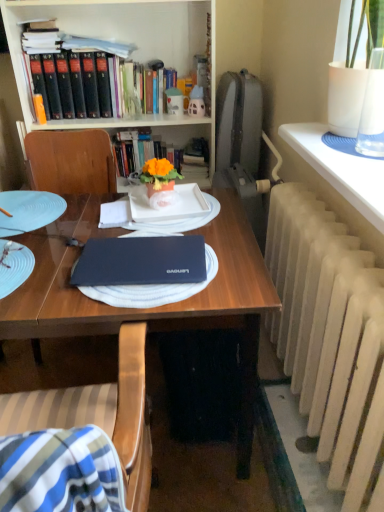
What is the approximate width of matte black bookcase at upper left?

It is 16.62 inches.

The image size is (384, 512). What are the coordinates of `white matte plate at center` in the screenshot? It's located at (154, 221).

Describe the element at coordinates (141, 261) in the screenshot. The width and height of the screenshot is (384, 512). I see `matte black laptop at center` at that location.

What is the approximate width of orange matte flower pot at center?

It is 6.07 inches.

This screenshot has height=512, width=384. Find the location of `white painted radiator at right`. white painted radiator at right is located at coordinates (326, 324).

Considering the relative sizes of orange matte flower pot at center and blue matte glass plate at left in the image provided, is orange matte flower pot at center smaller than blue matte glass plate at left?

No, orange matte flower pot at center is not smaller than blue matte glass plate at left.

What's the angular difference between orange matte flower pot at center and blue matte glass plate at left's facing directions?

6.93 degrees separate the facing orientations of orange matte flower pot at center and blue matte glass plate at left.

Considering the positions of objects orange matte flower pot at center and blue matte glass plate at left in the image provided, who is more to the left, orange matte flower pot at center or blue matte glass plate at left?

From the viewer's perspective, blue matte glass plate at left appears more on the left side.

From a real-world perspective, does orange matte flower pot at center sit lower than blue matte glass plate at left?

No, from a real-world perspective, orange matte flower pot at center is not below blue matte glass plate at left.

Can you tell me how much matte black laptop at center and orange matte flower pot at center differ in facing direction?

The angular difference between matte black laptop at center and orange matte flower pot at center is 84.2 degrees.

From a real-world perspective, which object stands above the other?

orange matte flower pot at center.

Considering the relative sizes of matte black laptop at center and orange matte flower pot at center in the image provided, is matte black laptop at center taller than orange matte flower pot at center?

Indeed, matte black laptop at center has a greater height compared to orange matte flower pot at center.

Which point is more distant from viewer, (233, 283) or (174, 169)?

Positioned behind is point (174, 169).

From the image's perspective, which object appears higher, wooden chair at center or white painted radiator at right?

white painted radiator at right, from the image's perspective.

Is point (29, 424) behind point (354, 346)?

That is False.

Is wooden chair at center facing away from white painted radiator at right?

No, white painted radiator at right is not at the back of wooden chair at center.

Looking at this image, is wooden chair at center smaller than white painted radiator at right?

Actually, wooden chair at center might be larger than white painted radiator at right.

Which object is positioned more to the left, white textured radiator at right, the 1th table when ordered from right to left, or orange matte flower pot at center?

From the viewer's perspective, orange matte flower pot at center appears more on the left side.

Which object is further away from the camera, white textured radiator at right, which ranks as the second table in back-to-front order, or orange matte flower pot at center?

orange matte flower pot at center is further from the camera.

Who is taller, white textured radiator at right, the 1th table positioned from the front, or orange matte flower pot at center?

orange matte flower pot at center is taller.

Is white textured radiator at right, the 1th table positioned from the front, thinner than orange matte flower pot at center?

No.

Is matte black laptop at center far from white textured radiator at right, the 1th table when ordered from right to left?

No, matte black laptop at center is in close proximity to white textured radiator at right, the 1th table when ordered from right to left.

Is matte black laptop at center facing away from white textured radiator at right, which is counted as the 2th table, starting from the left?

No, matte black laptop at center is not facing the opposite direction of white textured radiator at right, which is counted as the 2th table, starting from the left.

Image resolution: width=384 pixels, height=512 pixels. I want to click on laptop on the left of the white textured radiator at right, which is counted as the 2th table, starting from the left, so click(x=141, y=261).

From the image's perspective, is matte black laptop at center beneath white textured radiator at right, the 1th table positioned from the front?

Yes, from the image's perspective, matte black laptop at center is beneath white textured radiator at right, the 1th table positioned from the front.

From a real-world perspective, between white painted radiator at right and matte black laptop at center, who is vertically higher?

In real-world perspective, white painted radiator at right is above.

In the scene shown: Is white painted radiator at right far away from matte black laptop at center?

Actually, white painted radiator at right and matte black laptop at center are a little close together.

From the picture: Is white painted radiator at right spatially inside matte black laptop at center, or outside of it?

white painted radiator at right exists outside the volume of matte black laptop at center.

What's the angular difference between white painted radiator at right and matte black laptop at center's facing directions?

white painted radiator at right and matte black laptop at center are facing 88.1 degrees away from each other.

In terms of width, does white textured radiator at right, the 1th table positioned from the front, look wider or thinner when compared to matte black laptop at center?

In the image, white textured radiator at right, the 1th table positioned from the front, appears to be more narrow than matte black laptop at center.

Considering the positions of point (294, 133) and point (250, 396), is point (294, 133) closer or farther from the camera than point (250, 396)?

Point (294, 133) is positioned farther from the camera compared to point (250, 396).

From the image's perspective, which is below, white textured radiator at right, which ranks as the second table in back-to-front order, or matte black laptop at center?

matte black laptop at center is shown below in the image.

This screenshot has width=384, height=512. What are the coordinates of `table that is the 2nd one above the matte black laptop at center (from a real-world perspective)` in the screenshot? It's located at (341, 169).

Identify the location of glass plate below the orange matte flower pot at center (from a real-world perspective). The image size is (384, 512). (28, 211).

Locate an element on the screen. desk in front of the orange matte flower pot at center is located at coordinates pyautogui.click(x=157, y=307).

Considering their positions, is white matte plate at center positioned further to white textured radiator at right, which ranks as the second table in back-to-front order, than blue matte glass plate at left?

Among the two, blue matte glass plate at left is located further to white textured radiator at right, which ranks as the second table in back-to-front order.

Based on their spatial positions, is white painted radiator at right or matte black bookcase at upper left closer to wooden chair at center?

The object closer to wooden chair at center is white painted radiator at right.

Which object lies further to the anchor point blue matte glass plate at left, white painted radiator at right or matte black bookcase at upper left?

white painted radiator at right.

Considering their positions, is white painted radiator at right positioned further to matte black laptop at center than glossy brown table at center, placed as the 1th table when sorted from back to front?

Among the two, white painted radiator at right is located further to matte black laptop at center.

Estimate the real-world distances between objects in this image. Which object is further from matte black bookcase at upper left, matte black laptop at center or white textured radiator at right, which is counted as the 2th table, starting from the left?

white textured radiator at right, which is counted as the 2th table, starting from the left, lies further to matte black bookcase at upper left than the other object.

Estimate the real-world distances between objects in this image. Which object is further from wooden chair at center, matte black bookcase at upper left or white textured radiator at right, the 1th table when ordered from right to left?

Among the two, matte black bookcase at upper left is located further to wooden chair at center.

Consider the image. Looking at the image, which one is located closer to matte black bookcase at upper left, glossy brown table at center, which ranks as the second table in front-to-back order, or white matte plate at center?

Based on the image, glossy brown table at center, which ranks as the second table in front-to-back order, appears to be nearer to matte black bookcase at upper left.

Based on their spatial positions, is matte black laptop at center or white matte plate at center closer to white painted radiator at right?

Among the two, matte black laptop at center is located nearer to white painted radiator at right.

This screenshot has height=512, width=384. What are the coordinates of `laptop between blue matte glass plate at left and white painted radiator at right` in the screenshot? It's located at (141, 261).

At what (x,y) coordinates should I click in order to perform the action: click on laptop between blue matte glass plate at left and orange matte flower pot at center in the horizontal direction. Please return your answer as a coordinate pair (x, y). Looking at the image, I should click on (141, 261).

Where is `laptop positioned between matte black laptop at center and glossy brown table at center, acting as the 2th table starting from the right, from near to far`? This screenshot has width=384, height=512. laptop positioned between matte black laptop at center and glossy brown table at center, acting as the 2th table starting from the right, from near to far is located at coordinates (141, 261).

The height and width of the screenshot is (512, 384). What are the coordinates of `desk between glossy brown table at center, placed as the 1th table when sorted from back to front, and white textured radiator at right, which is counted as the 2th table, starting from the left` in the screenshot? It's located at (157, 307).